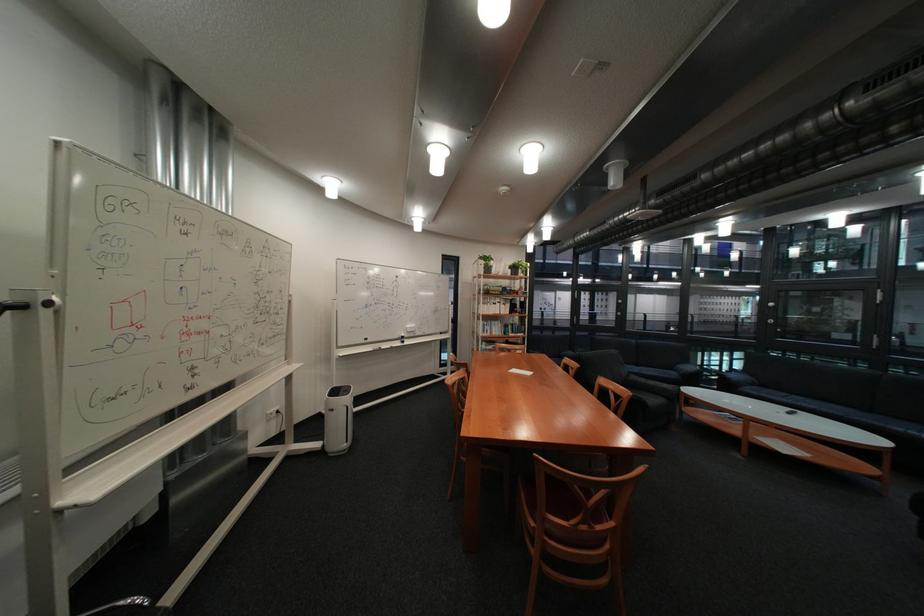
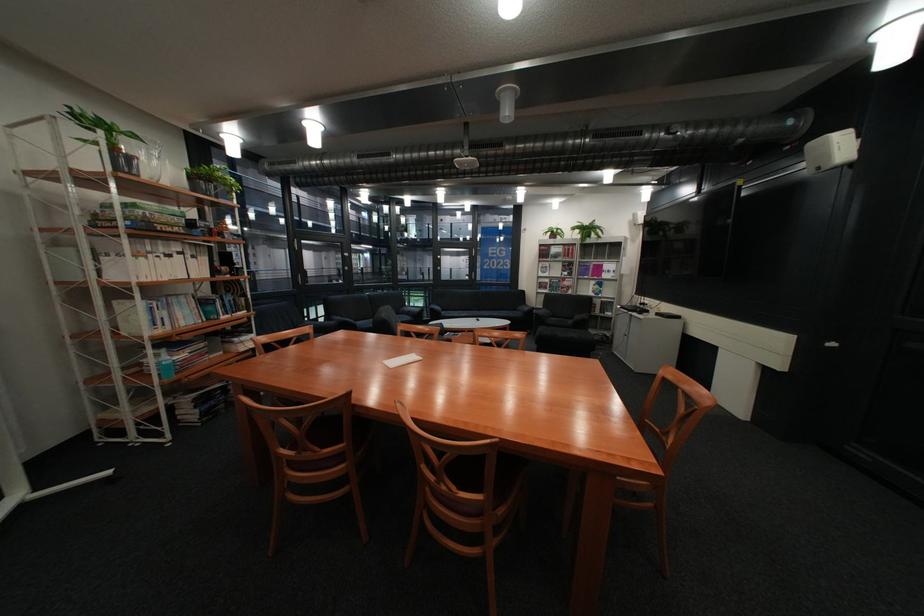
In the second image, find the point that corresponds to point (495, 342) in the first image.

(165, 351)